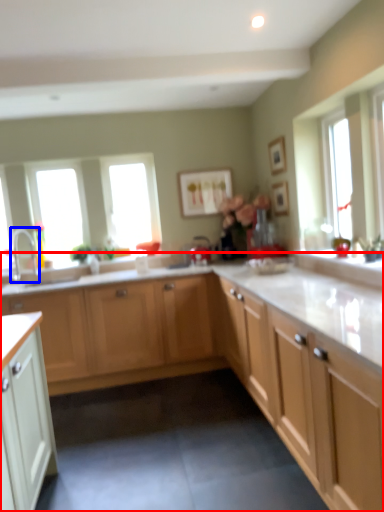
Question: Which object appears closest to the camera in this image, cabinetry (highlighted by a red box) or tap (highlighted by a blue box)?

Choices:
 (A) cabinetry
 (B) tap

Answer: (A)